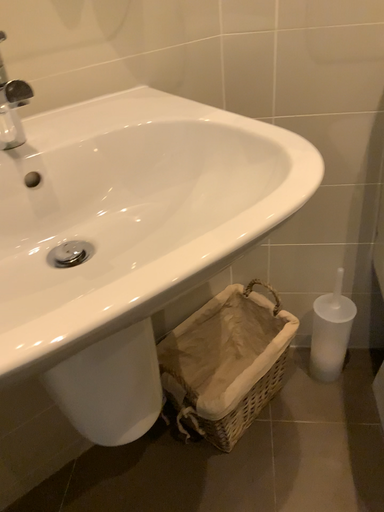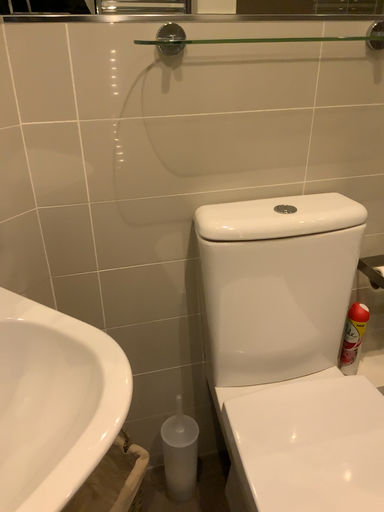
Question: How did the camera likely rotate when shooting the video?

Choices:
 (A) rotated left
 (B) rotated right

Answer: (B)